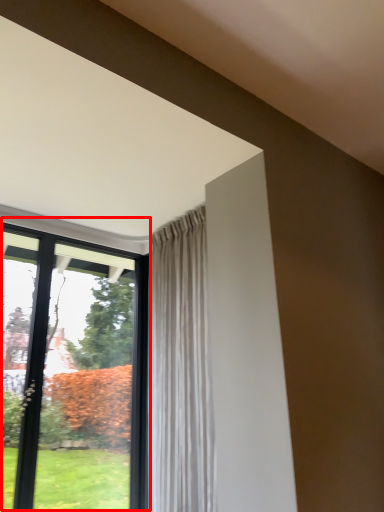
Question: Considering the relative positions of window (annotated by the red box) and curtain in the image provided, where is window (annotated by the red box) located with respect to the staircase?

Choices:
 (A) left
 (B) right

Answer: (A)